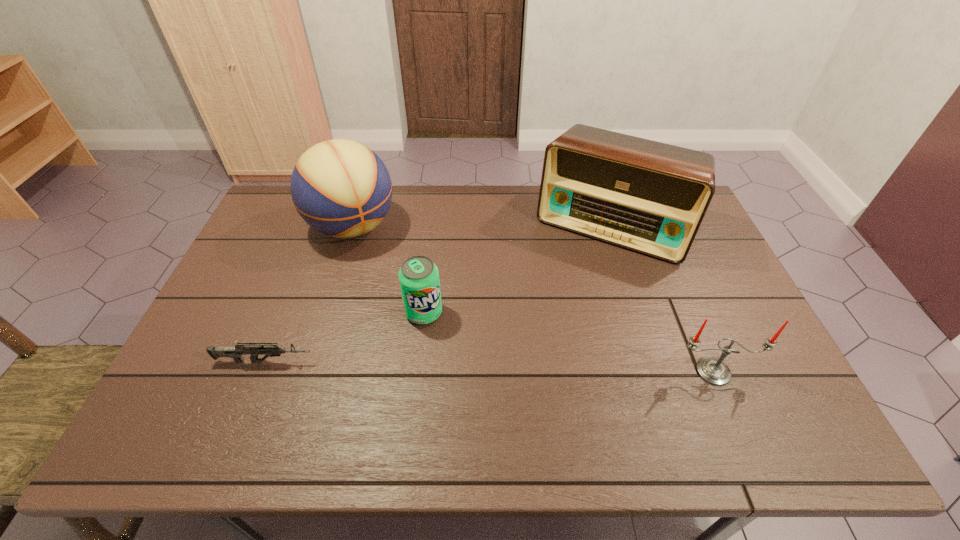
I want to click on the shortest object, so click(x=236, y=352).

Identify the location of candle. (714, 371).

The width and height of the screenshot is (960, 540). I want to click on basketball, so click(x=341, y=188).

You are a GUI agent. You are given a task and a screenshot of the screen. Output one action in this format:
    pyautogui.click(x=<x>, y=<y>)
    Task: Click on the radio receiver
    The width and height of the screenshot is (960, 540).
    Given the screenshot: What is the action you would take?
    pyautogui.click(x=650, y=197)

Where is `the third nearest object`? The image size is (960, 540). the third nearest object is located at coordinates (419, 281).

Locate an element on the screen. The width and height of the screenshot is (960, 540). the third object from left to right is located at coordinates (419, 281).

Find the location of a particular element. The image size is (960, 540). free location located aimed along the barrel of the shortest object is located at coordinates (425, 361).

Locate an element on the screen. Image resolution: width=960 pixels, height=540 pixels. free point located 0.110m on the patterned surface of the basketball is located at coordinates (385, 274).

Find the location of a particular element. vacant space located 0.310m on the patterned surface of the basketball is located at coordinates (416, 318).

Find the location of a particular element. This screenshot has width=960, height=540. vacant region located on the patterned surface of the basketball is located at coordinates (384, 272).